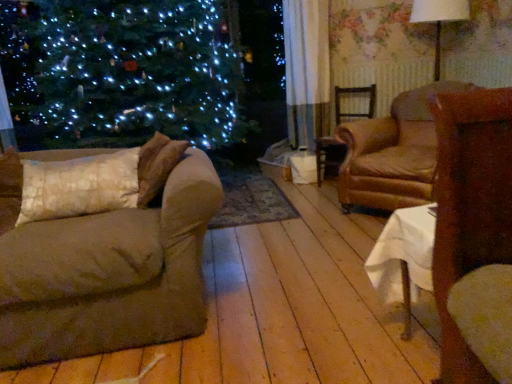
Question: From a real-world perspective, is white fabric lampshade at upper right positioned above or below brown leather armchair at center-right, which ranks as the 2th chair in back-to-front order?

Choices:
 (A) above
 (B) below

Answer: (A)

Question: Considering the positions of white fabric lampshade at upper right and brown leather armchair at center-right, which is the 1th chair from front to back, in the image, is white fabric lampshade at upper right bigger or smaller than brown leather armchair at center-right, which is the 1th chair from front to back,?

Choices:
 (A) big
 (B) small

Answer: (B)

Question: Estimate the real-world distances between objects in this image. Which object is farther from the brown fabric couch at left?

Choices:
 (A) white fabric lampshade at upper right
 (B) white textured pillow at left
 (C) brown wooden chair at center, the first chair in the back-to-front sequence
 (D) brown leather armchair at center-right, which is the 1th chair from front to back

Answer: (A)

Question: Considering the real-world distances, which object is farthest from the brown leather armchair at center-right, which ranks as the 2th chair in back-to-front order?

Choices:
 (A) brown fabric couch at left
 (B) brown wooden chair at center, positioned as the 2th chair in front-to-back order
 (C) white textured pillow at left
 (D) white fabric lampshade at upper right

Answer: (C)